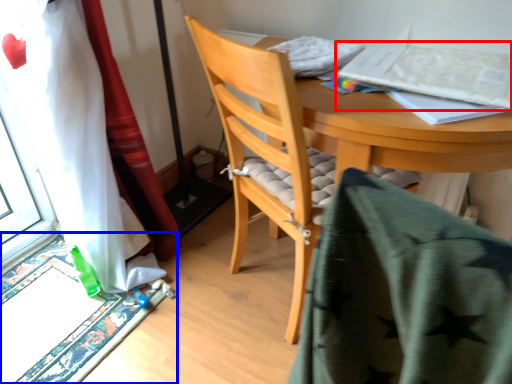
Question: Among these objects, which one is farthest to the camera, paperback book (highlighted by a red box) or doormat (highlighted by a blue box)?

Choices:
 (A) paperback book
 (B) doormat

Answer: (B)